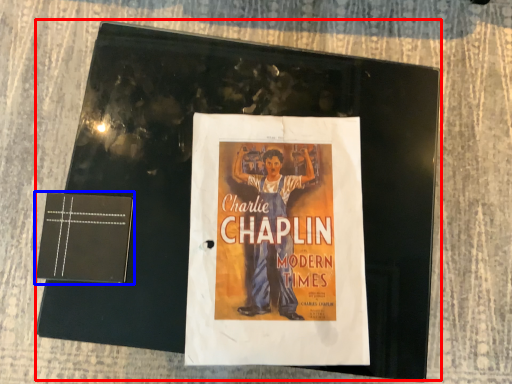
Question: Which object appears closest to the camera in this image, magazine (highlighted by a red box) or paperback book (highlighted by a blue box)?

Choices:
 (A) magazine
 (B) paperback book

Answer: (B)